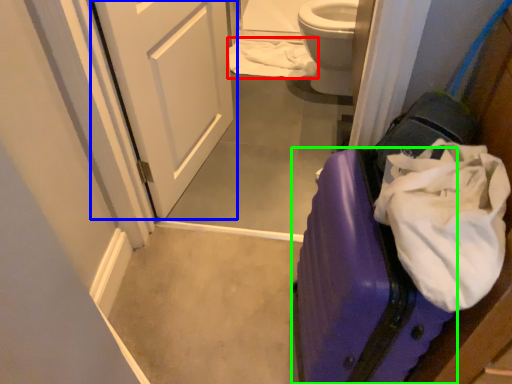
Question: Based on their relative distances, which object is nearer to toilet paper (highlighted by a red box)? Choose from door (highlighted by a blue box) and suitcase (highlighted by a green box).

Choices:
 (A) door
 (B) suitcase

Answer: (A)